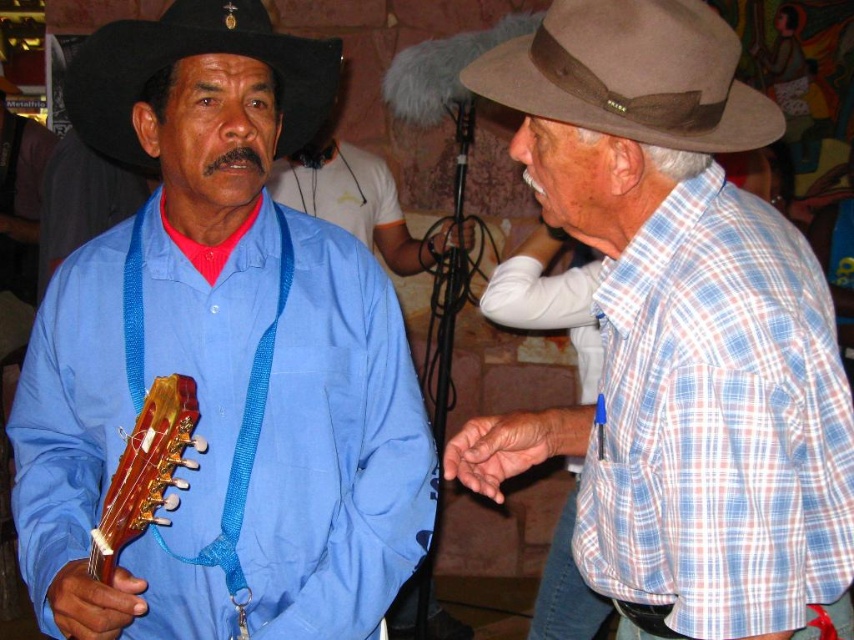
You are at a music festival and need to take a photo of the blue woven shirt at center and the black felt fedora at upper left. Which object should you focus on first to ensure both are in the frame without moving the camera?

The blue woven shirt at center is in front of the black felt fedora at upper left, so you should focus on the black felt fedora at upper left first to ensure both are in the frame without moving the camera.

You are at a music festival and need to place a 1.2 meter long banner between the black felt fedora at upper left and the wooden acoustic guitar at left. Can the banner fit vertically between them?

The black felt fedora at upper left is shorter than the wooden acoustic guitar at left, so the vertical space between them might not accommodate a 1.2 meter banner. Check the actual distance for accuracy.

You are at a music festival and see the blue woven shirt at center and the black felt fedora at upper left. Which item is positioned lower in the image?

The blue woven shirt at center is located below the black felt fedora at upper left, so the blue woven shirt at center is positioned lower in the image.